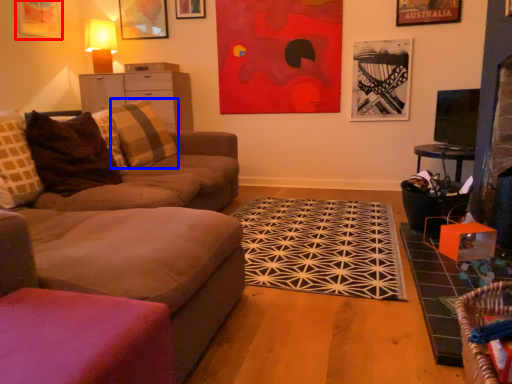
Question: Among these objects, which one is farthest to the camera, picture frame (highlighted by a red box) or pillow (highlighted by a blue box)?

Choices:
 (A) picture frame
 (B) pillow

Answer: (A)